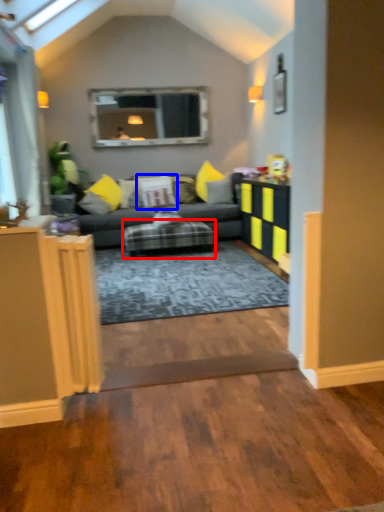
Question: Which of the following is the farthest to the observer, furniture (highlighted by a red box) or pillow (highlighted by a blue box)?

Choices:
 (A) furniture
 (B) pillow

Answer: (B)